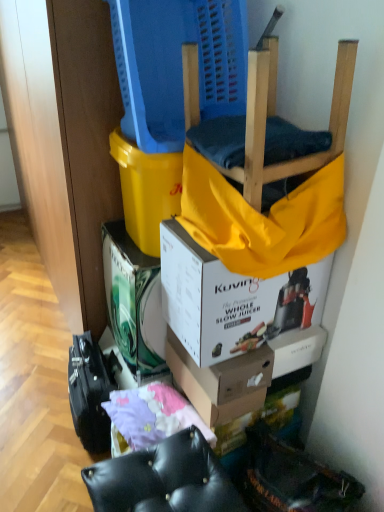
Question: Is white cardboard box at center, the first box from the back, aimed at white cardboard box at upper center, the 3th box viewed from the back?

Choices:
 (A) yes
 (B) no

Answer: (B)

Question: From a real-world perspective, is white cardboard box at center, arranged as the third box when viewed from the front, positioned over white cardboard box at upper center, placed as the 1th box when sorted from front to back, based on gravity?

Choices:
 (A) no
 (B) yes

Answer: (A)

Question: Is white cardboard box at center, arranged as the third box when viewed from the front, facing away from white cardboard box at upper center, placed as the 1th box when sorted from front to back?

Choices:
 (A) yes
 (B) no

Answer: (B)

Question: Is white cardboard box at center, the first box from the back, thinner than white cardboard box at upper center, placed as the 1th box when sorted from front to back?

Choices:
 (A) yes
 (B) no

Answer: (A)

Question: Can you confirm if white cardboard box at center, arranged as the third box when viewed from the front, is taller than white cardboard box at upper center, placed as the 1th box when sorted from front to back?

Choices:
 (A) no
 (B) yes

Answer: (B)

Question: Considering the positions of wooden chair at upper center and purple fabric at lower center in the image, is wooden chair at upper center wider or thinner than purple fabric at lower center?

Choices:
 (A) wide
 (B) thin

Answer: (A)

Question: Is wooden chair at upper center inside the boundaries of purple fabric at lower center, or outside?

Choices:
 (A) outside
 (B) inside

Answer: (A)

Question: From a real-world perspective, relative to purple fabric at lower center, is wooden chair at upper center vertically above or below?

Choices:
 (A) above
 (B) below

Answer: (A)

Question: Considering their positions, is wooden chair at upper center located in front of or behind purple fabric at lower center?

Choices:
 (A) behind
 (B) front

Answer: (B)

Question: Considering the positions of wooden chair at upper center and white cardboard box at center, the first box from the back, in the image, is wooden chair at upper center taller or shorter than white cardboard box at center, the first box from the back,?

Choices:
 (A) short
 (B) tall

Answer: (A)

Question: Considering the positions of wooden chair at upper center and white cardboard box at center, the first box from the back, in the image, is wooden chair at upper center wider or thinner than white cardboard box at center, the first box from the back,?

Choices:
 (A) thin
 (B) wide

Answer: (B)

Question: Based on their positions, is wooden chair at upper center located to the left or right of white cardboard box at center, the first box from the back?

Choices:
 (A) right
 (B) left

Answer: (A)

Question: Does point (198, 86) appear closer or farther from the camera than point (137, 368)?

Choices:
 (A) farther
 (B) closer

Answer: (B)

Question: Considering the positions of white cardboard box at upper center, placed as the 1th box when sorted from front to back, and black leather ottoman at lower center in the image, is white cardboard box at upper center, placed as the 1th box when sorted from front to back, wider or thinner than black leather ottoman at lower center?

Choices:
 (A) thin
 (B) wide

Answer: (A)

Question: Considering the positions of white cardboard box at upper center, placed as the 1th box when sorted from front to back, and black leather ottoman at lower center in the image, is white cardboard box at upper center, placed as the 1th box when sorted from front to back, taller or shorter than black leather ottoman at lower center?

Choices:
 (A) short
 (B) tall

Answer: (A)